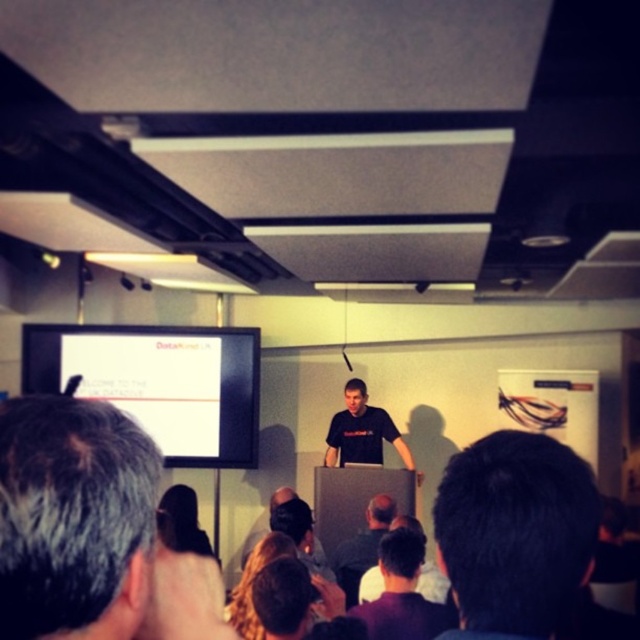
You are sitting in the audience and want to look at two points in the presentation room. The first point is point (445, 556) and the second point is point (330, 420). Which point is closer to you?

Point (445, 556) is closer to the viewer than point (330, 420).

You are designing a poster for the presentation and want to highlight the speaker. Since the dark brown hair at center and the black matte shirt at center are both in the center, which one should you make larger to emphasize the speaker?

The dark brown hair at center occupies less space than the black matte shirt at center, so to emphasize the speaker, you should make the dark brown hair at center larger in the poster.

In the scene shown: You are the presenter standing at the podium. You need to adjust the lighting to ensure your slides displayed on the white matte projection screen at upper center are clearly visible. Considering the gray hair at upper left of the audience members, where should you avoid shining the light to prevent glare?

You should avoid shining light directly on the gray hair at upper left because it is located above the white matte projection screen at upper center, and this could create glare that obscures the screen.